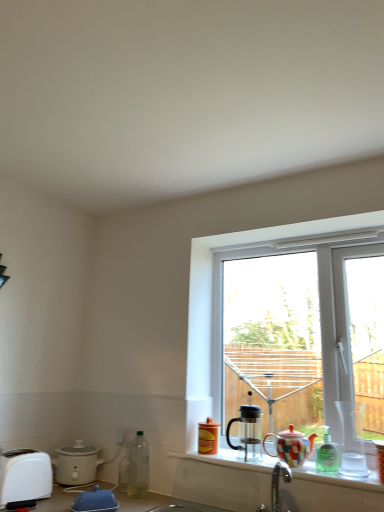
Find the location of a particular element. This screenshot has width=384, height=512. free area behind transparent glass coffee pot at window, the 3th coffee cup when ordered from right to left is located at coordinates (248, 448).